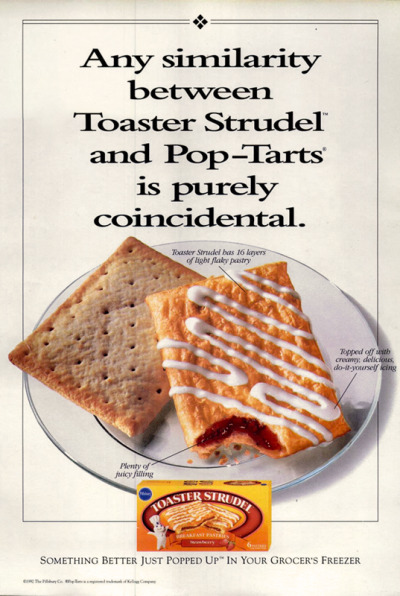
Find the location of a particular element. Image resolution: width=400 pixels, height=596 pixels. plate is located at coordinates pos(99,430).